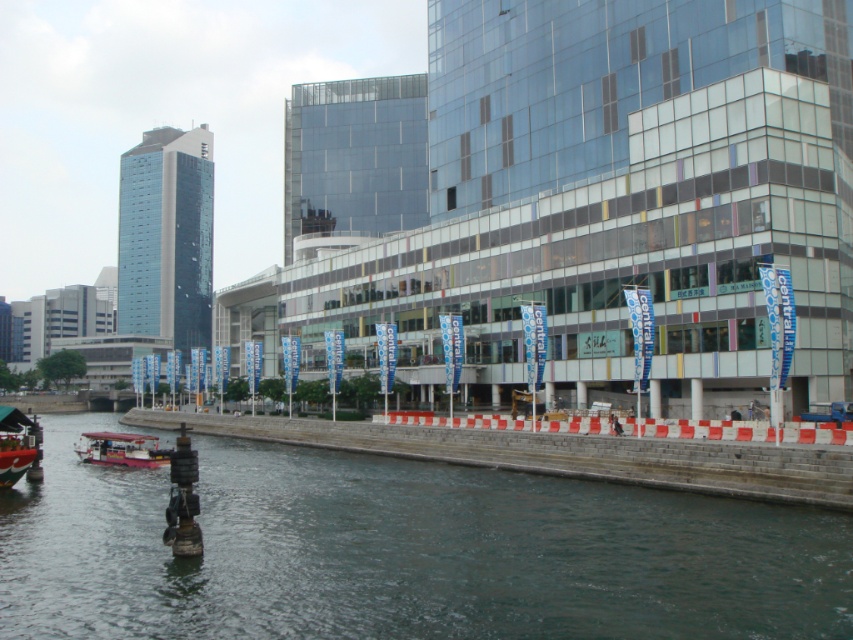
Which is more to the left, red plastic boat at lower left or pink plastic boat at lower left?

Positioned to the left is pink plastic boat at lower left.

Does red plastic boat at lower left appear over pink plastic boat at lower left?

Yes.

Between point (16, 436) and point (120, 452), which one is positioned behind?

The point (120, 452) is behind.

You are a GUI agent. You are given a task and a screenshot of the screen. Output one action in this format:
    pyautogui.click(x=<x>, y=<y>)
    Task: Click on the red plastic boat at lower left
    The image size is (853, 640).
    Given the screenshot: What is the action you would take?
    pyautogui.click(x=16, y=445)

Describe the element at coordinates (404, 552) in the screenshot. I see `dark gray water at lower left` at that location.

Does dark gray water at lower left appear on the left side of red plastic boat at lower left?

In fact, dark gray water at lower left is to the right of red plastic boat at lower left.

Which is in front, point (489, 470) or point (4, 444)?

Positioned in front is point (4, 444).

Where is `dark gray water at lower left`? This screenshot has height=640, width=853. dark gray water at lower left is located at coordinates (404, 552).

Does point (846, 554) come farther from viewer compared to point (136, 449)?

That is False.

Does dark gray water at lower left have a larger size compared to pink plastic boat at lower left?

Indeed, dark gray water at lower left has a larger size compared to pink plastic boat at lower left.

Between point (401, 532) and point (120, 460), which one is positioned behind?

Point (120, 460)

The height and width of the screenshot is (640, 853). Identify the location of dark gray water at lower left. (404, 552).